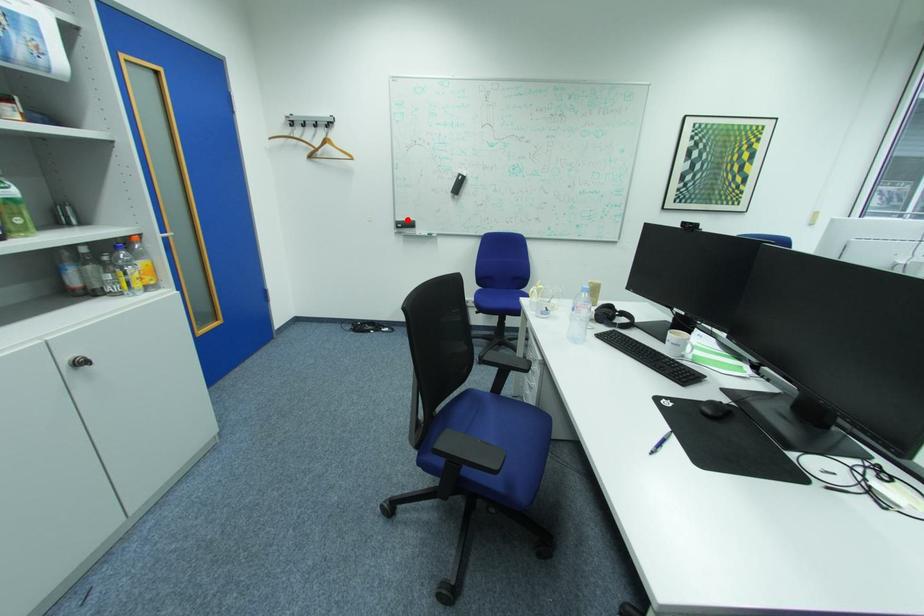
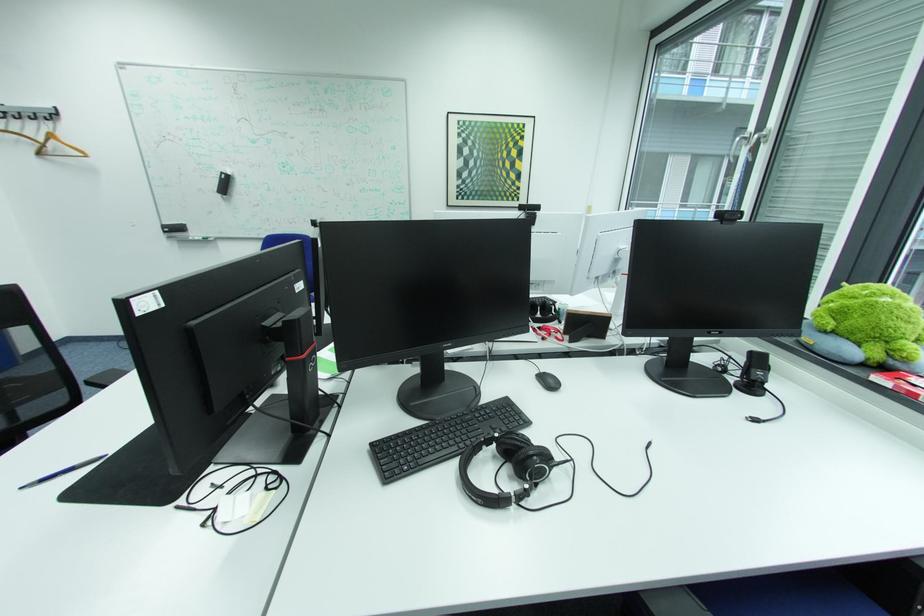
Question: I am providing you with two images of the same scene from different viewpoints. In image1, a red point is highlighted. Considering the same 3D point in image2, which of the following is correct?

Choices:
 (A) It is closer
 (B) It is farther

Answer: (B)